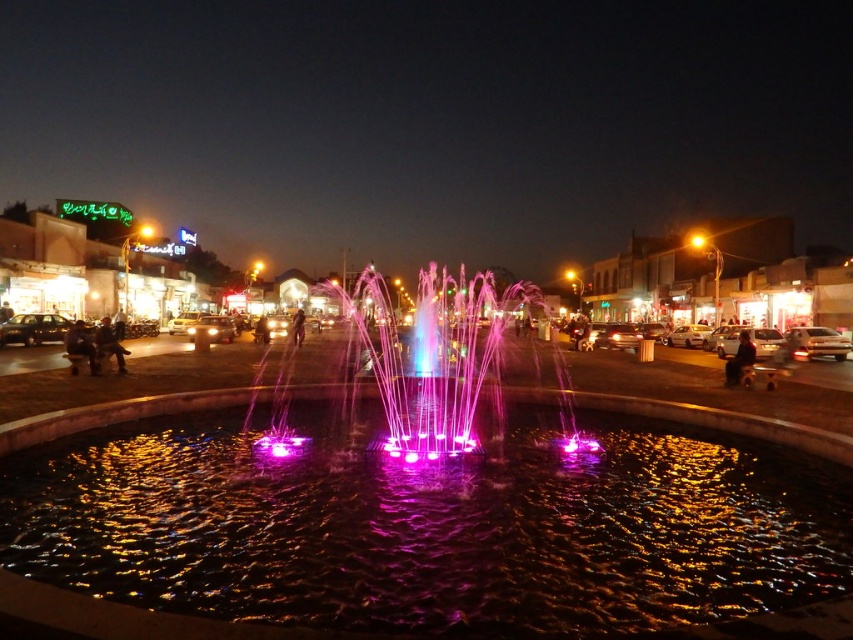
Does purple illuminated water at center come in front of multicolored illuminated water at center?

That is True.

The image size is (853, 640). Find the location of `purple illuminated water at center`. purple illuminated water at center is located at coordinates (125, 616).